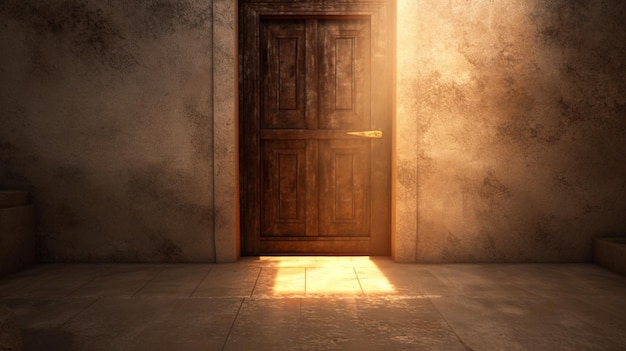
The height and width of the screenshot is (351, 626). In order to click on floor in this screenshot , I will do `click(317, 313)`.